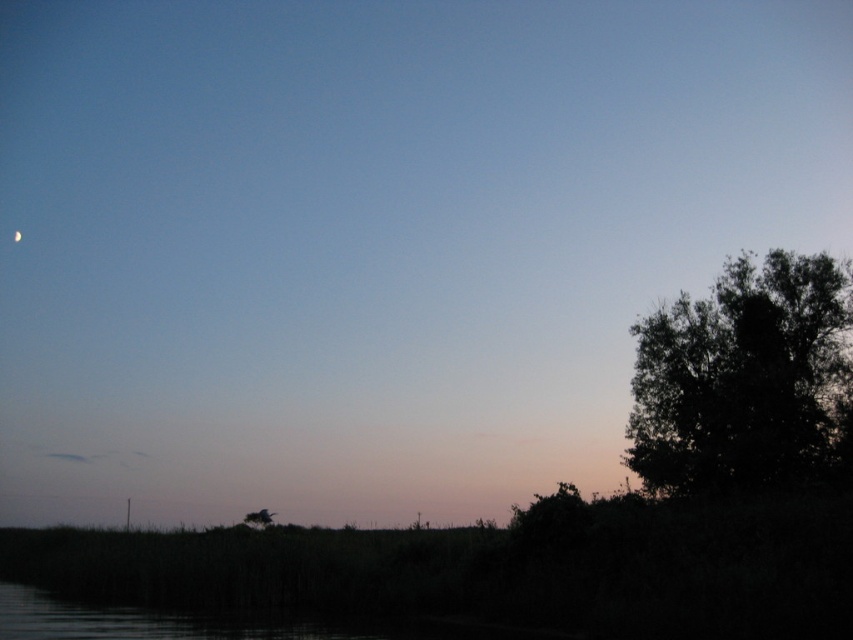
Can you confirm if dark green leafy tree at right is bigger than silver metallic moon at upper left?

Indeed, dark green leafy tree at right has a larger size compared to silver metallic moon at upper left.

Identify the location of dark green leafy tree at right. (741, 376).